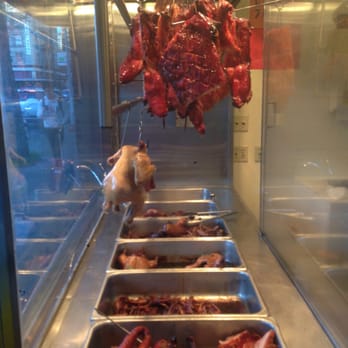
Find the location of a particular element. The height and width of the screenshot is (348, 348). silver metallic hook is located at coordinates (140, 131).